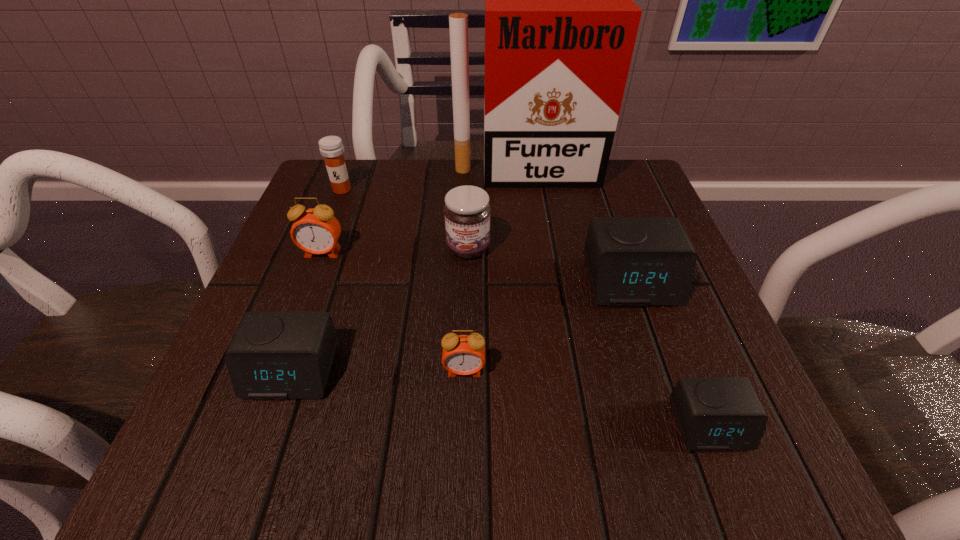
Where is `the shortest alarm clock`? This screenshot has height=540, width=960. the shortest alarm clock is located at coordinates (713, 413).

Where is `the smallest black alarm clock`? Image resolution: width=960 pixels, height=540 pixels. the smallest black alarm clock is located at coordinates (713, 413).

You are a GUI agent. You are given a task and a screenshot of the screen. Output one action in this format:
    pyautogui.click(x=<x>, y=<y>)
    Task: Click on the vacant space located on the front-facing side of the red cigarette case
    
    Given the screenshot: What is the action you would take?
    pyautogui.click(x=543, y=295)

What are the coordinates of `vacant space located on the face of the left pink alarm clock` in the screenshot? It's located at pyautogui.click(x=257, y=424).

The width and height of the screenshot is (960, 540). I want to click on blank space located on the label side of the medicine, so (x=300, y=300).

Find the location of a particular element. The height and width of the screenshot is (540, 960). vacant region located on the front label of the jam is located at coordinates (464, 405).

Where is `vacant space located on the front-facing side of the farthest black alarm clock`? vacant space located on the front-facing side of the farthest black alarm clock is located at coordinates (670, 396).

I want to click on free point located on the face of the third alarm clock from left to right, so click(x=463, y=433).

At what (x,y) coordinates should I click in order to perform the action: click on vacant area situated 0.080m on the front-facing side of the second smallest black alarm clock. Please return your answer as a coordinate pair (x, y). Looking at the image, I should click on (260, 460).

You are a GUI agent. You are given a task and a screenshot of the screen. Output one action in this format:
    pyautogui.click(x=<x>, y=<y>)
    Task: Click on the cigarette case that is positioned at the far edge
    Image resolution: width=960 pixels, height=540 pixels.
    Given the screenshot: What is the action you would take?
    pyautogui.click(x=560, y=23)